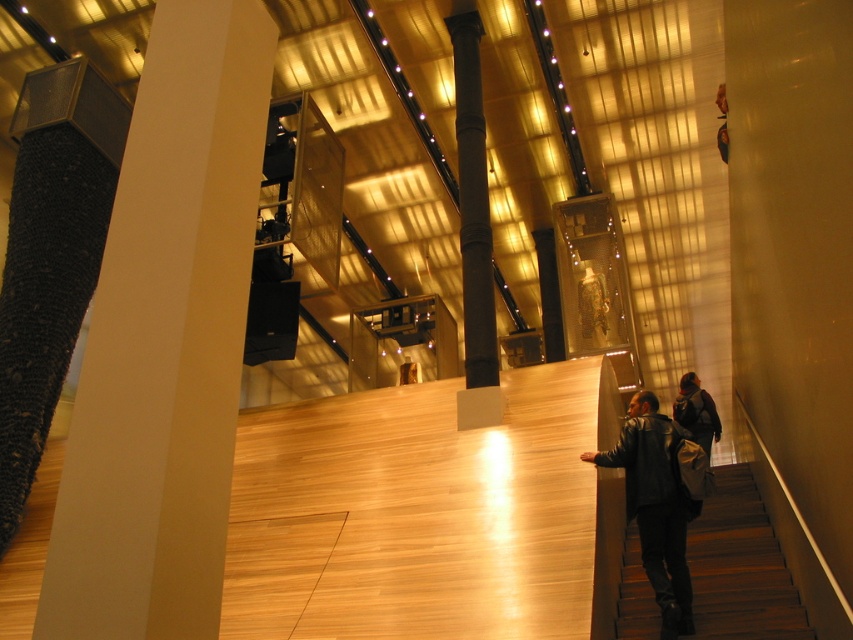
Question: Is dark leather jacket at lower right to the right of black polished column at center from the viewer's perspective?

Choices:
 (A) no
 (B) yes

Answer: (B)

Question: Which point appears farthest from the camera in this image?

Choices:
 (A) (474, 323)
 (B) (117, 346)

Answer: (A)

Question: Which object is closer to the camera taking this photo?

Choices:
 (A) dark wood stairs at lower right
 (B) white matte column at left

Answer: (B)

Question: Among these points, which one is farthest from the camera?

Choices:
 (A) (119, 451)
 (B) (664, 579)
 (C) (683, 404)
 (D) (474, 256)

Answer: (C)

Question: Does white matte column at left lie behind dark leather jacket at lower right?

Choices:
 (A) no
 (B) yes

Answer: (A)

Question: Is dark wood stairs at lower right below dark leather jacket at lower right?

Choices:
 (A) yes
 (B) no

Answer: (A)